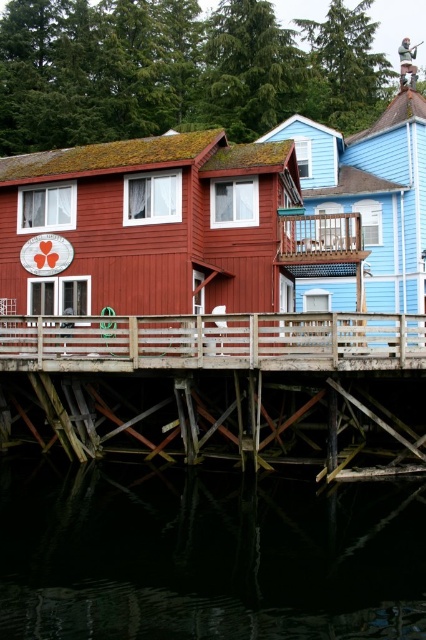
Question: Where is wooden at lower center located in relation to wooden at center in the image?

Choices:
 (A) left
 (B) right

Answer: (B)

Question: Which object is farther from the camera taking this photo?

Choices:
 (A) wooden at lower center
 (B) wooden at center

Answer: (B)

Question: Among these objects, which one is nearest to the camera?

Choices:
 (A) wooden at lower center
 (B) dark reflective water at lower center

Answer: (B)

Question: Which object is farther from the camera taking this photo?

Choices:
 (A) wooden at lower center
 (B) dark reflective water at lower center

Answer: (A)

Question: Does wooden at lower center appear under wooden at center?

Choices:
 (A) yes
 (B) no

Answer: (A)

Question: Is dark reflective water at lower center smaller than wooden at center?

Choices:
 (A) no
 (B) yes

Answer: (A)